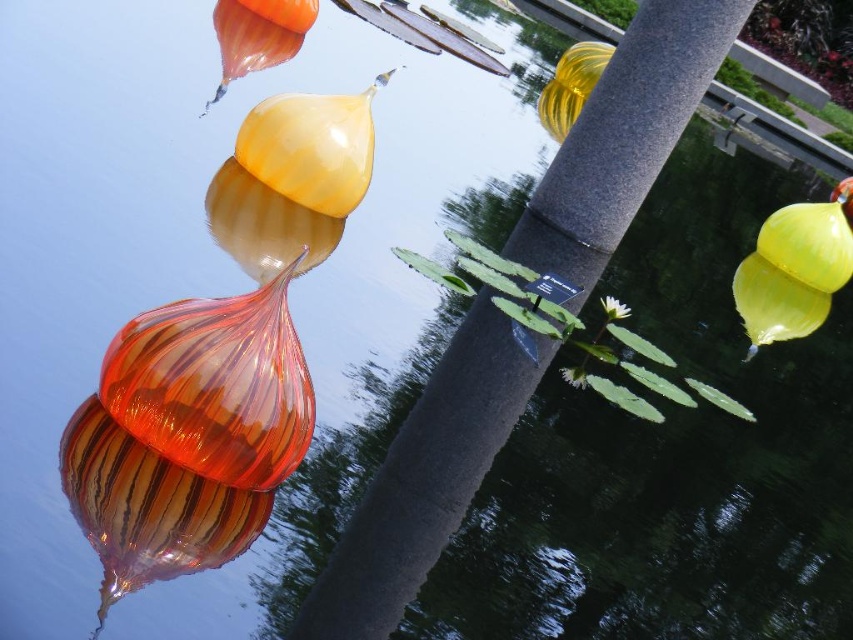
You are a gardener who wants to place a new decoration between the translucent amber glass vase at center and the white matte flower at center. Since you want it to be smaller than both, which one should you use as a reference for size?

The translucent amber glass vase at center is bigger than the white matte flower at center, so you should use the white matte flower at center as a reference for size to ensure the new decoration is smaller than both.

You are a photographer trying to capture the white matte flower at center in the garden scene. The camera is set up at the edge of the pond. Based on the coordinates provided, can you determine if the dark gray pole in the foreground will block your view of the flower?

The white matte flower at center is located at coordinates point (614, 307). Since the dark gray pole is in the foreground and partially obscuring the view of the pond and the glass art, it is likely blocking the direct line of sight to the flower unless adjusted.

You are a gardener who wants to place a new decoration between the translucent amber glass vase at center and the white matte flower at center. To ensure there is enough space, you need to know which one is wider. Which object is wider?

The translucent amber glass vase at center might be wider than the white matte flower at center.